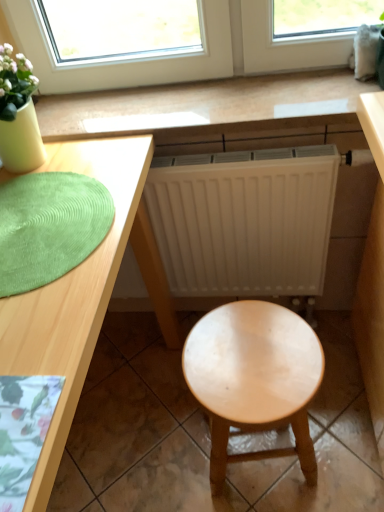
This screenshot has width=384, height=512. Find the location of `vacant space situated above green textured mat at left (from a real-world perspective)`. vacant space situated above green textured mat at left (from a real-world perspective) is located at coordinates pos(44,209).